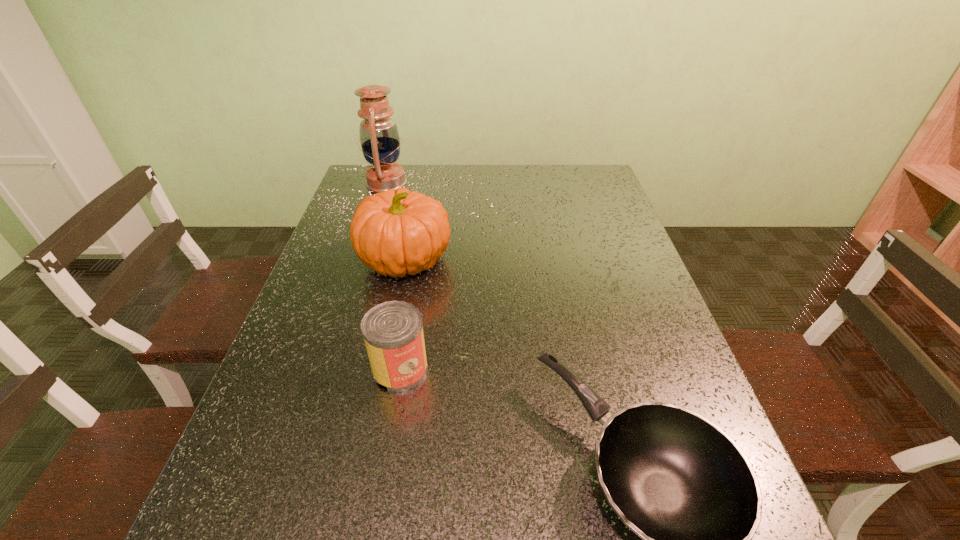
What are the coordinates of `pumpkin that is at the left edge` in the screenshot? It's located at (396, 232).

Where is `object that is at the far left corner`? object that is at the far left corner is located at coordinates (379, 138).

This screenshot has width=960, height=540. Find the location of `vacant space at the far edge of the desktop`. vacant space at the far edge of the desktop is located at coordinates (506, 187).

At what (x,y) coordinates should I click in order to perform the action: click on vacant space at the left edge of the desktop. Please return your answer as a coordinate pair (x, y). This screenshot has width=960, height=540. Looking at the image, I should click on (327, 271).

Locate an element on the screen. The image size is (960, 540). vacant space at the right edge is located at coordinates (610, 204).

Choose which object is the nearest neighbor to the second shortest object. Please provide its 2D coordinates. Your answer should be formatted as a tuple, i.e. [(x, y)], where the tuple contains the x and y coordinates of a point satisfying the conditions above.

[(396, 232)]

Identify which object is located as the nearest to the oil lamp. Please provide its 2D coordinates. Your answer should be formatted as a tuple, i.e. [(x, y)], where the tuple contains the x and y coordinates of a point satisfying the conditions above.

[(396, 232)]

Identify the location of free spot that satisfies the following two spatial constraints: 1. on the surface of the second farthest object; 2. on the back side of the third tallest object. This screenshot has height=540, width=960. (384, 369).

You are a GUI agent. You are given a task and a screenshot of the screen. Output one action in this format:
    pyautogui.click(x=<x>, y=<y>)
    Task: Click on the vacant space that satisfies the following two spatial constraints: 1. on the back side of the third tallest object; 2. on the surface of the second tallest object
    
    Given the screenshot: What is the action you would take?
    pyautogui.click(x=419, y=260)